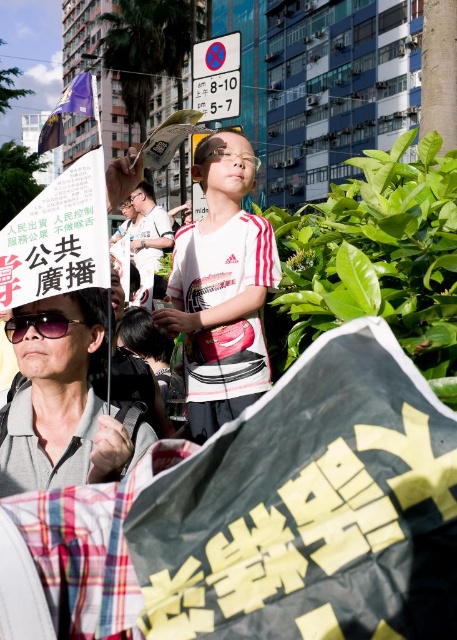
Question: Is purple fabric flag at upper left further to camera compared to black matte sunglasses at lower left?

Choices:
 (A) yes
 (B) no

Answer: (A)

Question: Can you confirm if matte gray shirt at lower left is thinner than purple fabric flag at upper left?

Choices:
 (A) no
 (B) yes

Answer: (B)

Question: Which point is farther to the camera?

Choices:
 (A) (59, 314)
 (B) (69, 356)
 (C) (210, 244)
 (D) (79, 112)

Answer: (C)

Question: Which of these objects is positioned farthest from the purple fabric flag at upper left?

Choices:
 (A) matte gray shirt at lower left
 (B) white matte shirt at center
 (C) white matte shirt at upper center
 (D) black matte sunglasses at lower left

Answer: (C)

Question: Which of these objects is positioned closest to the matte gray shirt at lower left?

Choices:
 (A) purple fabric flag at upper left
 (B) white matte shirt at center

Answer: (B)

Question: In this image, where is white matte shirt at center located relative to matte gray shirt at lower left?

Choices:
 (A) right
 (B) left

Answer: (A)